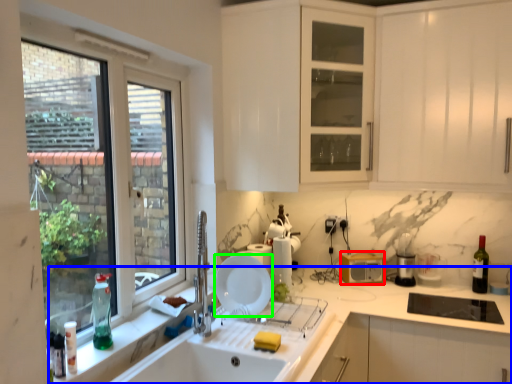
Question: Estimate the real-world distances between objects in this image. Which object is farther from appliance (highlighted by a red box), countertop (highlighted by a blue box) or plate (highlighted by a green box)?

Choices:
 (A) countertop
 (B) plate

Answer: (B)